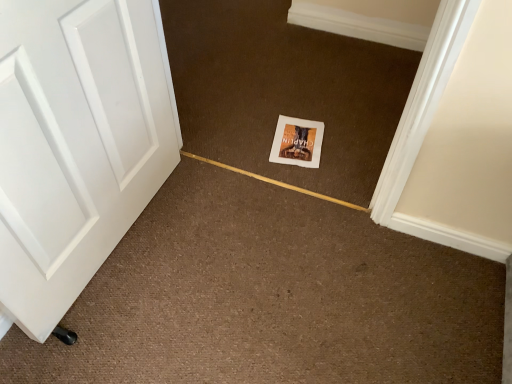
Where is `empty space that is to the right of white paper postcard at center`? Image resolution: width=512 pixels, height=384 pixels. empty space that is to the right of white paper postcard at center is located at coordinates (351, 142).